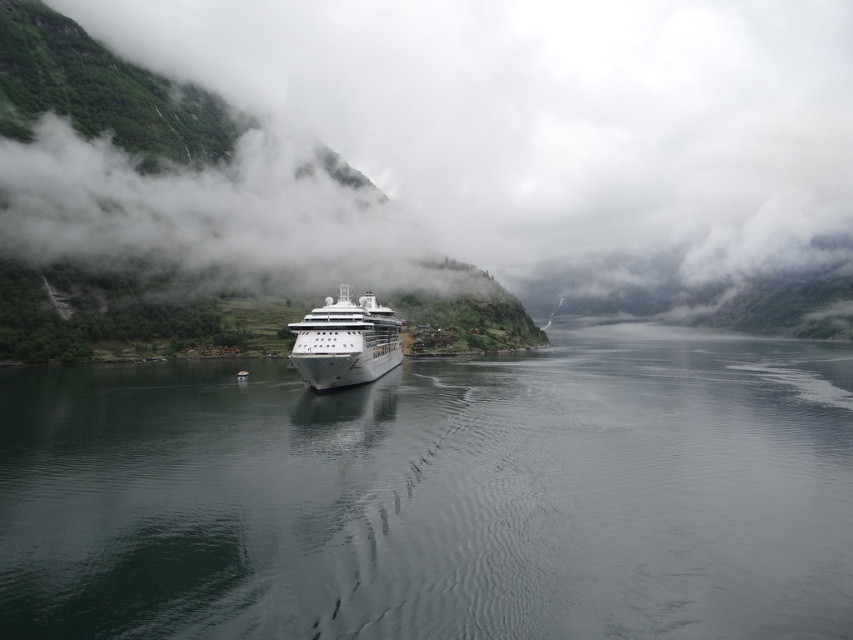
Between green matte cloud at center and white glossy cruise ship at center, which one appears on the right side from the viewer's perspective?

From the viewer's perspective, green matte cloud at center appears more on the right side.

What do you see at coordinates (550, 124) in the screenshot? I see `green matte cloud at center` at bounding box center [550, 124].

This screenshot has width=853, height=640. In order to click on green matte cloud at center in this screenshot , I will do `click(550, 124)`.

Does dark gray water at center appear on the left side of green matte cloud at center?

Yes, dark gray water at center is to the left of green matte cloud at center.

Does dark gray water at center have a smaller size compared to green matte cloud at center?

Indeed, dark gray water at center has a smaller size compared to green matte cloud at center.

Locate an element on the screen. Image resolution: width=853 pixels, height=640 pixels. dark gray water at center is located at coordinates (437, 497).

Locate an element on the screen. The height and width of the screenshot is (640, 853). dark gray water at center is located at coordinates (437, 497).

Which is more to the left, dark gray water at center or white glossy cruise ship at center?

From the viewer's perspective, white glossy cruise ship at center appears more on the left side.

Can you confirm if dark gray water at center is positioned below white glossy cruise ship at center?

Indeed, dark gray water at center is positioned under white glossy cruise ship at center.

Who is more distant from viewer, (163, 588) or (379, 369)?

Positioned behind is point (379, 369).

I want to click on dark gray water at center, so click(437, 497).